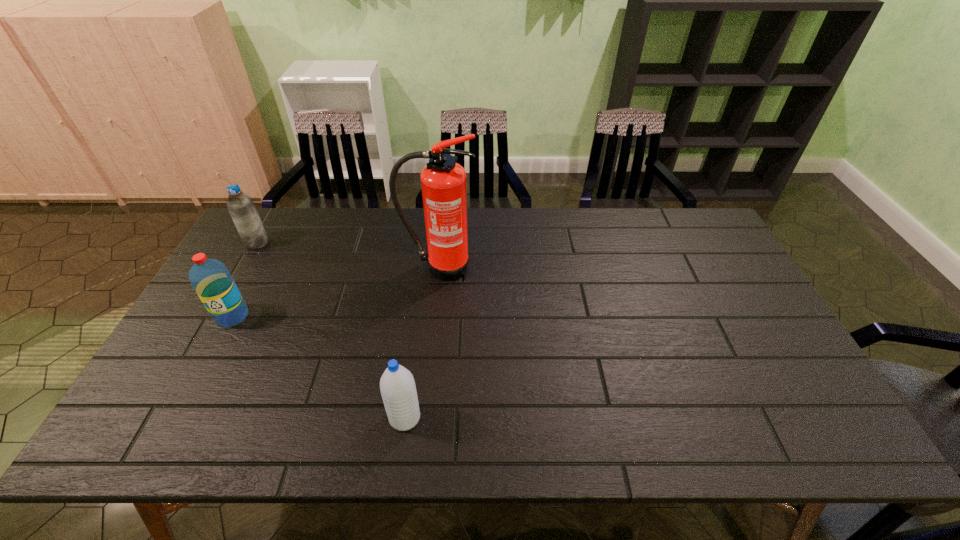
Where is `object located in the far edge section of the desktop`? object located in the far edge section of the desktop is located at coordinates (240, 206).

The image size is (960, 540). Identify the location of object present at the near edge. (397, 385).

Find the location of a particular element. object situated at the far left corner is located at coordinates (240, 206).

At what (x,y) coordinates should I click in order to perform the action: click on vacant space at the far edge of the desktop. Please return your answer as a coordinate pair (x, y). Looking at the image, I should click on (540, 226).

Find the location of a particular element. vacant position at the near edge of the desktop is located at coordinates (760, 440).

Identify the location of free space at the left edge of the desktop. The width and height of the screenshot is (960, 540). (194, 323).

In the image, there is a desktop. Where is `vacant space at the right edge`? vacant space at the right edge is located at coordinates point(756,341).

You are a GUI agent. You are given a task and a screenshot of the screen. Output one action in this format:
    pyautogui.click(x=<x>, y=<y>)
    Task: Click on the free space between the farthest water bottle and the tallest object
    The width and height of the screenshot is (960, 540).
    Given the screenshot: What is the action you would take?
    pyautogui.click(x=348, y=255)

Locate an element on the screen. This screenshot has height=540, width=960. vacant space that is in between the second nearest water bottle and the fire extinguisher is located at coordinates (336, 292).

You are a GUI agent. You are given a task and a screenshot of the screen. Output one action in this format:
    pyautogui.click(x=<x>, y=<y>)
    Task: Click on the free area in between the farthest water bottle and the second farthest object
    The width and height of the screenshot is (960, 540).
    Given the screenshot: What is the action you would take?
    pyautogui.click(x=348, y=255)